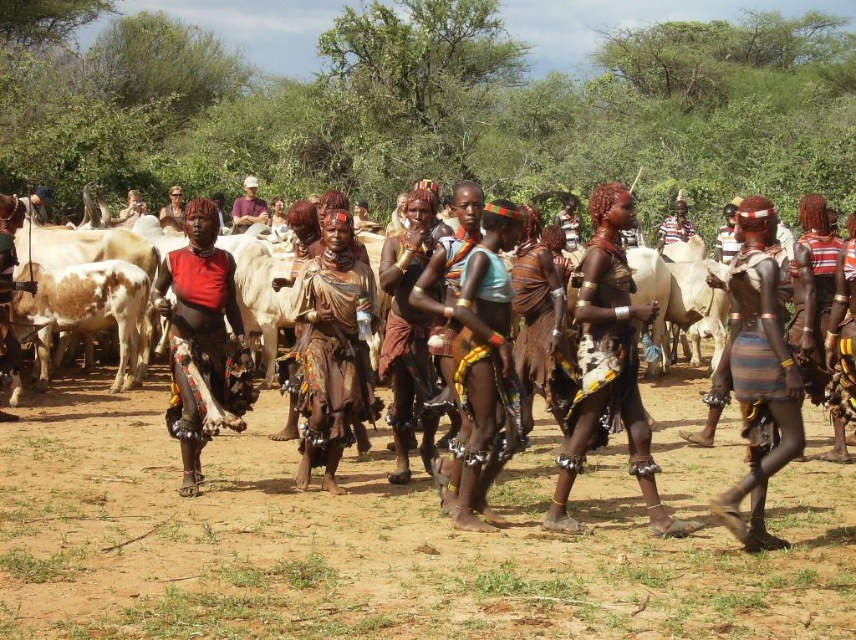
Question: Among these objects, which one is farthest from the camera?

Choices:
 (A) striped fabric skirt at right
 (B) striped fabric skirt at center
 (C) white cotton shirt at center
 (D) brown textured skirt at center

Answer: (C)

Question: Based on their relative distances, which object is nearer to the brown sandy ground at center?

Choices:
 (A) brown textured skirt at center
 (B) brown leather skirt at center
 (C) white cotton shirt at center

Answer: (B)

Question: In this image, where is striped fabric skirt at center located relative to white cotton shirt at center?

Choices:
 (A) left
 (B) right

Answer: (B)

Question: Is brown textured skirt at center closer to the viewer compared to striped fabric skirt at right?

Choices:
 (A) yes
 (B) no

Answer: (A)

Question: Which of these objects is positioned farthest from the brown leather skirt at center?

Choices:
 (A) black leather skirt at center
 (B) brown textured skirt at center
 (C) textured fabric dress at center
 (D) brown sandy ground at center

Answer: (D)

Question: From the image, what is the correct spatial relationship of black leather skirt at center in relation to brown leather skirt at center?

Choices:
 (A) below
 (B) above

Answer: (A)